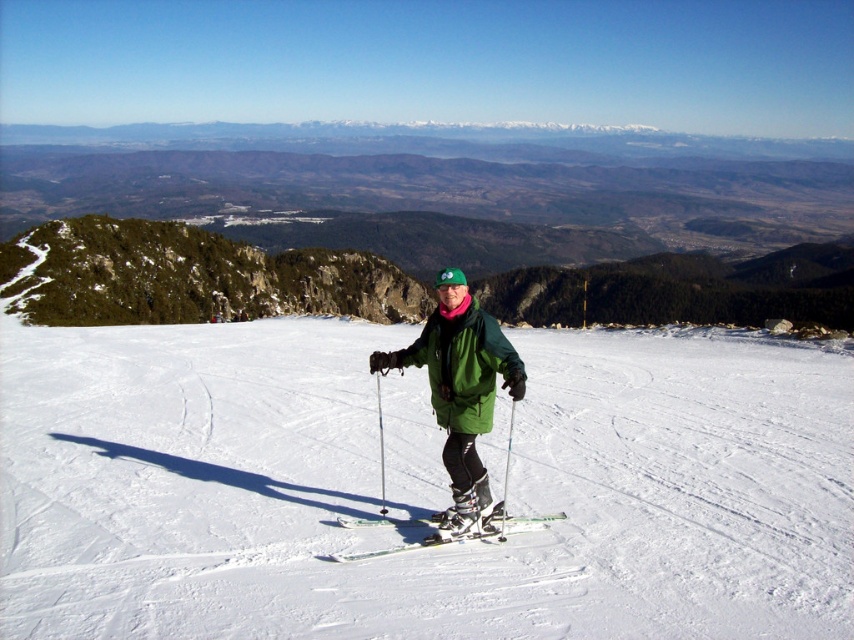
Question: Is green matte skis at center to the right of metallic silver ski pole at center from the viewer's perspective?

Choices:
 (A) no
 (B) yes

Answer: (B)

Question: Is green matte jacket at center to the left of metallic silver ski pole at center from the viewer's perspective?

Choices:
 (A) yes
 (B) no

Answer: (B)

Question: Which object is farther from the camera taking this photo?

Choices:
 (A) metallic silver ski pole at center
 (B) white smooth snow at center
 (C) green matte skis at center

Answer: (A)

Question: Which point is closer to the camera?

Choices:
 (A) (381, 448)
 (B) (363, 522)
 (C) (460, 417)

Answer: (C)

Question: Which object appears farthest from the camera in this image?

Choices:
 (A) white smooth snow at center
 (B) green matte skis at center
 (C) metallic silver ski pole at center
 (D) green matte jacket at center

Answer: (C)

Question: Does white smooth snow at center appear under green matte skis at center?

Choices:
 (A) no
 (B) yes

Answer: (A)